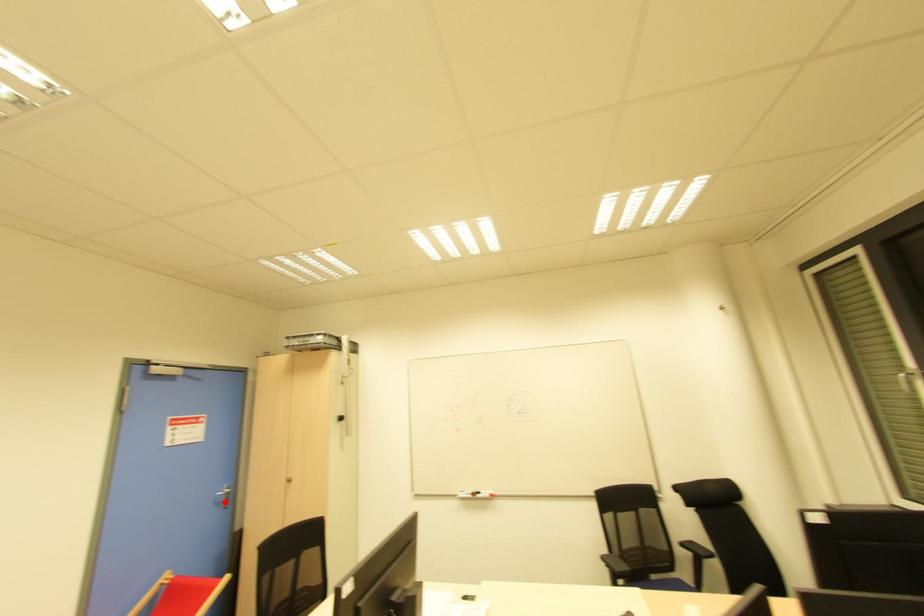
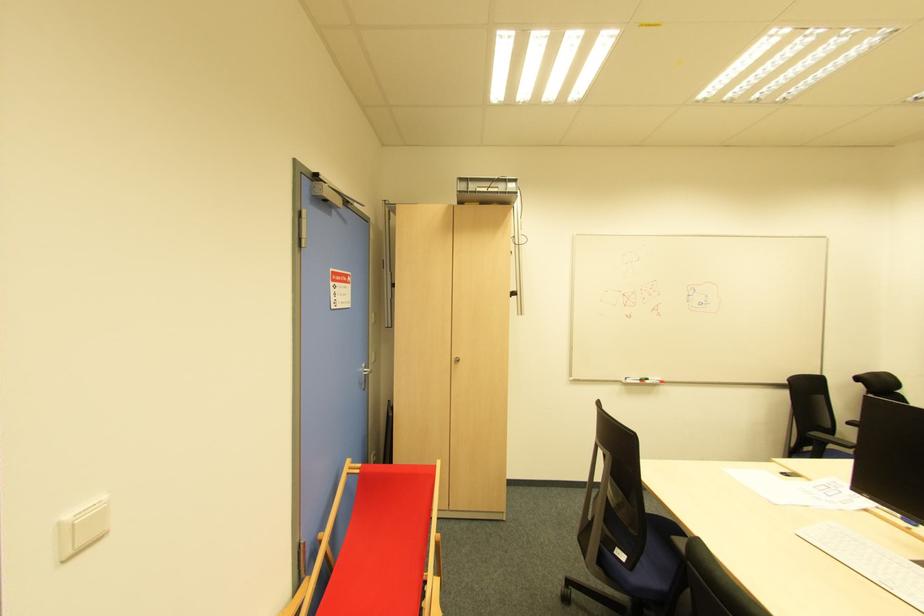
Find the pixel in the second image that matches the highlighted location in the first image.

(366, 382)